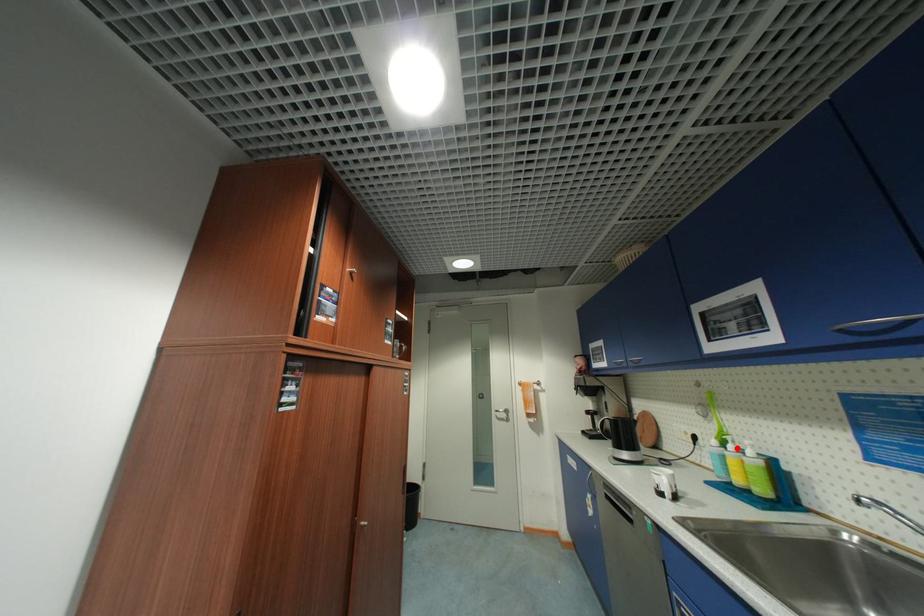
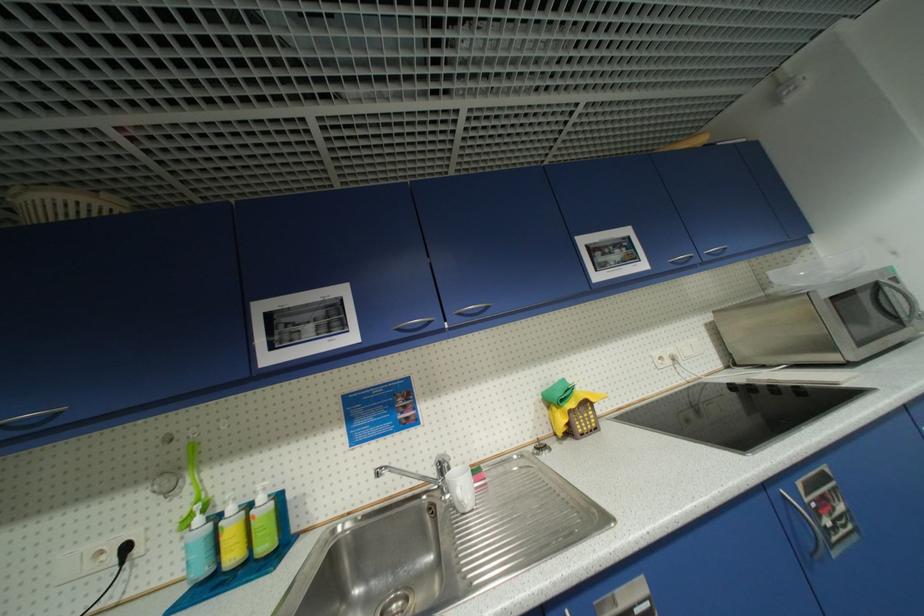
The point at the highlighted location is marked in the first image. Where is the corresponding point in the second image?

(237, 511)